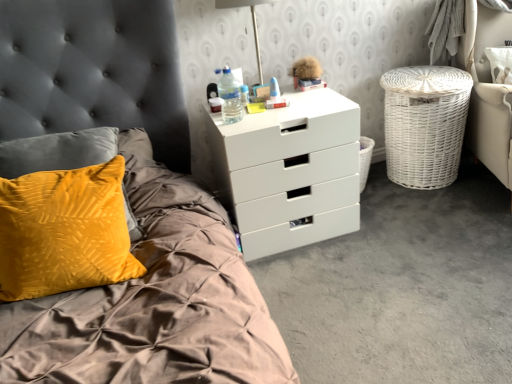
Locate an element on the screen. This screenshot has height=384, width=512. translucent plastic water bottle at upper right is located at coordinates (230, 97).

At what (x,y) coordinates should I click in order to perform the action: click on translucent plastic water bottle at upper right. Please return your answer as a coordinate pair (x, y). Looking at the image, I should click on (230, 97).

Are white wicker laundry basket at right and metallic silver lamp at upper center far apart?

Actually, white wicker laundry basket at right and metallic silver lamp at upper center are a little close together.

Does white wicker laundry basket at right have a lesser height compared to metallic silver lamp at upper center?

Incorrect, the height of white wicker laundry basket at right does not fall short of that of metallic silver lamp at upper center.

From the image's perspective, is white wicker laundry basket at right under metallic silver lamp at upper center?

Yes, from the image's perspective, white wicker laundry basket at right is beneath metallic silver lamp at upper center.

In the image, is white wicker laundry basket at right positioned in front of or behind metallic silver lamp at upper center?

In the image, white wicker laundry basket at right appears behind metallic silver lamp at upper center.

Are metallic silver lamp at upper center and white plastic chest of drawers at upper center located far from each other?

No, metallic silver lamp at upper center is not far from white plastic chest of drawers at upper center.

Is metallic silver lamp at upper center situated inside white plastic chest of drawers at upper center or outside?

metallic silver lamp at upper center is spatially situated outside white plastic chest of drawers at upper center.

Does metallic silver lamp at upper center appear on the right side of white plastic chest of drawers at upper center?

Incorrect, metallic silver lamp at upper center is not on the right side of white plastic chest of drawers at upper center.

From the image's perspective, which is above, metallic silver lamp at upper center or white plastic chest of drawers at upper center?

metallic silver lamp at upper center is shown above in the image.

Considering the relative sizes of white wicker laundry basket at right and white plastic chest of drawers at upper center in the image provided, is white wicker laundry basket at right taller than white plastic chest of drawers at upper center?

No, white wicker laundry basket at right is not taller than white plastic chest of drawers at upper center.

Locate an element on the screen. Image resolution: width=512 pixels, height=384 pixels. chest of drawers that appears on the left of white wicker laundry basket at right is located at coordinates (289, 172).

From the image's perspective, which object appears higher, white wicker laundry basket at right or white plastic chest of drawers at upper center?

white wicker laundry basket at right is shown above in the image.

Is white plastic chest of drawers at upper center surrounded by white wicker laundry basket at right?

No, white plastic chest of drawers at upper center is not a part of white wicker laundry basket at right.

At what (x,y) coordinates should I click in order to perform the action: click on bottle located above the white plastic chest of drawers at upper center (from the image's perspective). Please return your answer as a coordinate pair (x, y). Image resolution: width=512 pixels, height=384 pixels. Looking at the image, I should click on (230, 97).

Is white plastic chest of drawers at upper center bigger than translucent plastic water bottle at upper right?

Indeed, white plastic chest of drawers at upper center has a larger size compared to translucent plastic water bottle at upper right.

Can you confirm if white plastic chest of drawers at upper center is positioned to the left of translucent plastic water bottle at upper right?

Incorrect, white plastic chest of drawers at upper center is not on the left side of translucent plastic water bottle at upper right.

From the image's perspective, is white plastic chest of drawers at upper center positioned above or below translucent plastic water bottle at upper right?

white plastic chest of drawers at upper center is situated lower than translucent plastic water bottle at upper right in the image.

Is metallic silver lamp at upper center completely or partially outside of translucent plastic water bottle at upper right?

Yes, metallic silver lamp at upper center is outside of translucent plastic water bottle at upper right.

Is metallic silver lamp at upper center turned away from translucent plastic water bottle at upper right?

No, metallic silver lamp at upper center is not facing away from translucent plastic water bottle at upper right.

Who is taller, metallic silver lamp at upper center or translucent plastic water bottle at upper right?

metallic silver lamp at upper center.

Locate an element on the screen. bedside lamp above the translucent plastic water bottle at upper right (from a real-world perspective) is located at coordinates (252, 22).

Is white wicker armchair at right beside white wicker laundry basket at right?

white wicker armchair at right is not next to white wicker laundry basket at right, and they're not touching.

Looking at this image, does white wicker armchair at right have a lesser width compared to white wicker laundry basket at right?

No.

Is white wicker armchair at right in front of or behind white wicker laundry basket at right in the image?

Visually, white wicker armchair at right is located in front of white wicker laundry basket at right.

From the image's perspective, which one is positioned lower, white wicker armchair at right or white wicker laundry basket at right?

From the image's view, white wicker laundry basket at right is below.

From the picture: Can you tell me how much translucent plastic water bottle at upper right and white plastic chest of drawers at upper center differ in facing direction?

The angle between the facing direction of translucent plastic water bottle at upper right and the facing direction of white plastic chest of drawers at upper center is 1.05 degrees.

Which of these two, translucent plastic water bottle at upper right or white plastic chest of drawers at upper center, stands taller?

white plastic chest of drawers at upper center is taller.

Are translucent plastic water bottle at upper right and white plastic chest of drawers at upper center located far from each other?

translucent plastic water bottle at upper right is actually quite close to white plastic chest of drawers at upper center.

You are a GUI agent. You are given a task and a screenshot of the screen. Output one action in this format:
    pyautogui.click(x=<x>, y=<y>)
    Task: Click on the nightstand behind the metallic silver lamp at upper center
    
    Given the screenshot: What is the action you would take?
    pyautogui.click(x=425, y=124)

I want to click on the chest of drawers that is below the metallic silver lamp at upper center (from the image's perspective), so click(x=289, y=172).

When comparing their distances from translucent plastic water bottle at upper right, does white plastic chest of drawers at upper center or white wicker armchair at right seem closer?

Based on the image, white plastic chest of drawers at upper center appears to be nearer to translucent plastic water bottle at upper right.

Looking at the image, which one is located closer to white plastic chest of drawers at upper center, white wicker armchair at right or white wicker laundry basket at right?

Based on the image, white wicker laundry basket at right appears to be nearer to white plastic chest of drawers at upper center.

Looking at the image, which one is located closer to metallic silver lamp at upper center, white wicker laundry basket at right or white plastic chest of drawers at upper center?

white plastic chest of drawers at upper center is closer to metallic silver lamp at upper center.

Considering their positions, is translucent plastic water bottle at upper right positioned closer to white wicker laundry basket at right than white plastic chest of drawers at upper center?

The object closer to white wicker laundry basket at right is white plastic chest of drawers at upper center.

In the scene shown: Looking at the image, which one is located closer to white wicker laundry basket at right, metallic silver lamp at upper center or white wicker armchair at right?

white wicker armchair at right is closer to white wicker laundry basket at right.

When comparing their distances from metallic silver lamp at upper center, does translucent plastic water bottle at upper right or white wicker armchair at right seem closer?

Among the two, translucent plastic water bottle at upper right is located nearer to metallic silver lamp at upper center.

Which object lies further to the anchor point translucent plastic water bottle at upper right, white plastic chest of drawers at upper center or white wicker laundry basket at right?

The object further to translucent plastic water bottle at upper right is white wicker laundry basket at right.

From the image, which object appears to be nearer to white plastic chest of drawers at upper center, translucent plastic water bottle at upper right or white wicker armchair at right?

translucent plastic water bottle at upper right is closer to white plastic chest of drawers at upper center.

This screenshot has width=512, height=384. In order to click on nightstand between white plastic chest of drawers at upper center and white wicker armchair at right in the horizontal direction in this screenshot , I will do `click(425, 124)`.

I want to click on chest of drawers between metallic silver lamp at upper center and white wicker laundry basket at right, so click(x=289, y=172).

Identify the location of chest of drawers between translucent plastic water bottle at upper right and white wicker laundry basket at right in the horizontal direction. Image resolution: width=512 pixels, height=384 pixels. (289, 172).

What are the coordinates of `bedside lamp situated between translucent plastic water bottle at upper right and white wicker laundry basket at right from left to right` in the screenshot? It's located at (252, 22).